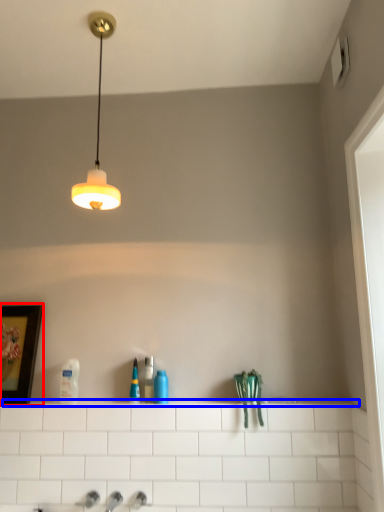
Question: Which of the following is the farthest to the observer, picture frame (highlighted by a red box) or ledge (highlighted by a blue box)?

Choices:
 (A) picture frame
 (B) ledge

Answer: (A)